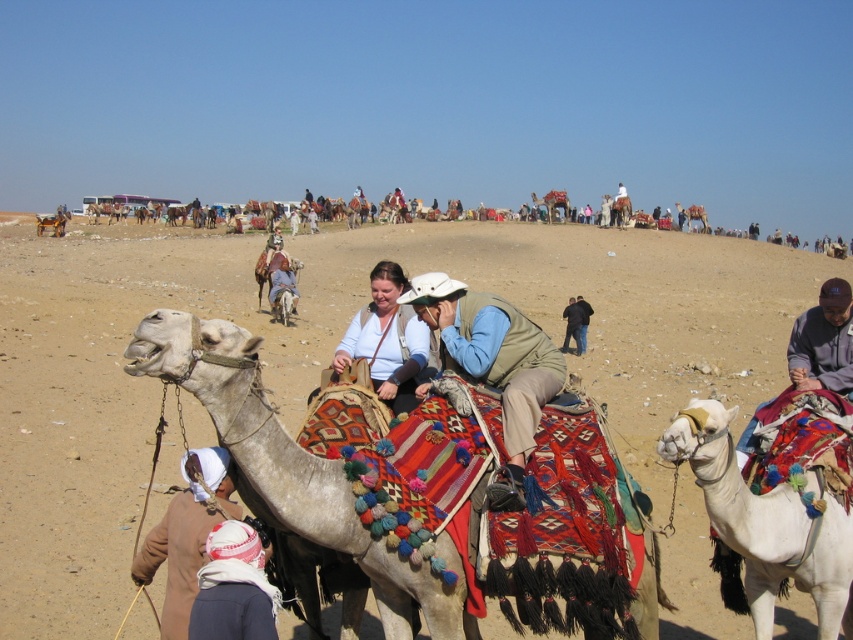
You are a photographer standing at the bottom left corner of the image. You want to take a picture of the white soft camel at center. Which direction should you move to get the best shot?

You should move towards the center of the image to get the best shot of the white soft camel at center since it is located at point (767,522), which is near the center.